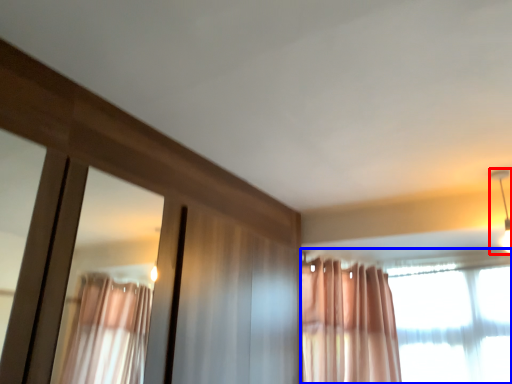
Question: Which of the following is the closest to the observer, light fixture (highlighted by a red box) or curtain (highlighted by a blue box)?

Choices:
 (A) light fixture
 (B) curtain

Answer: (B)